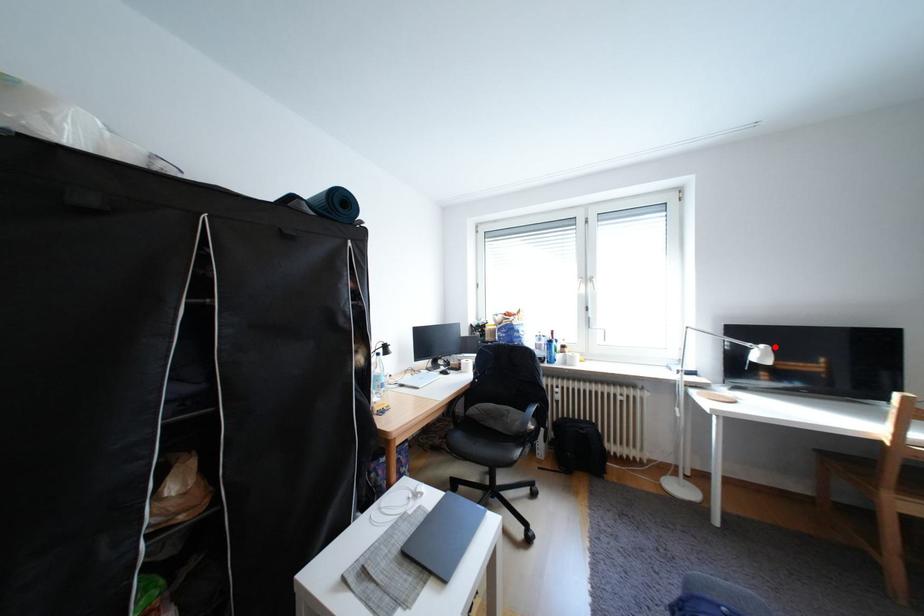
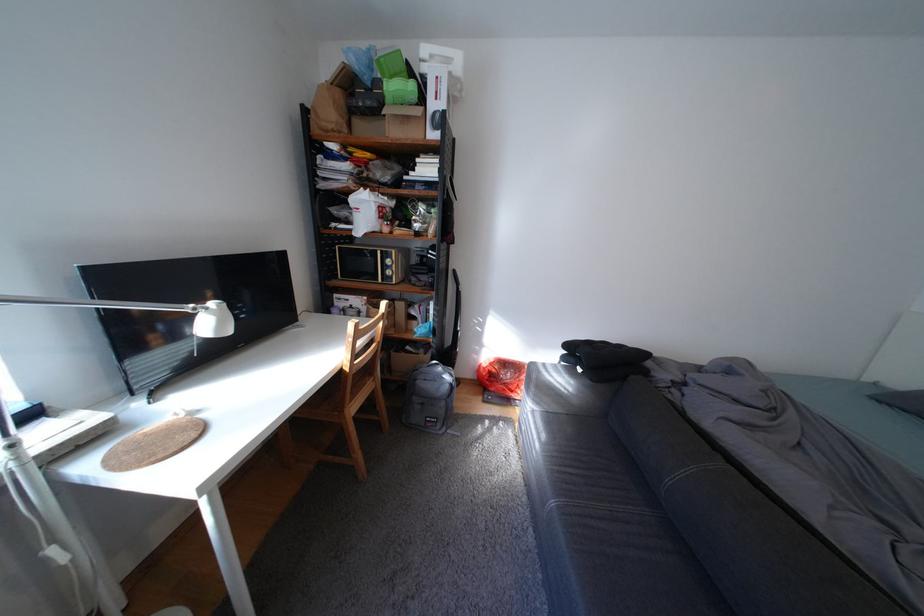
Where in the second image is the point corresponding to the highlighted location from the first image?

(225, 305)